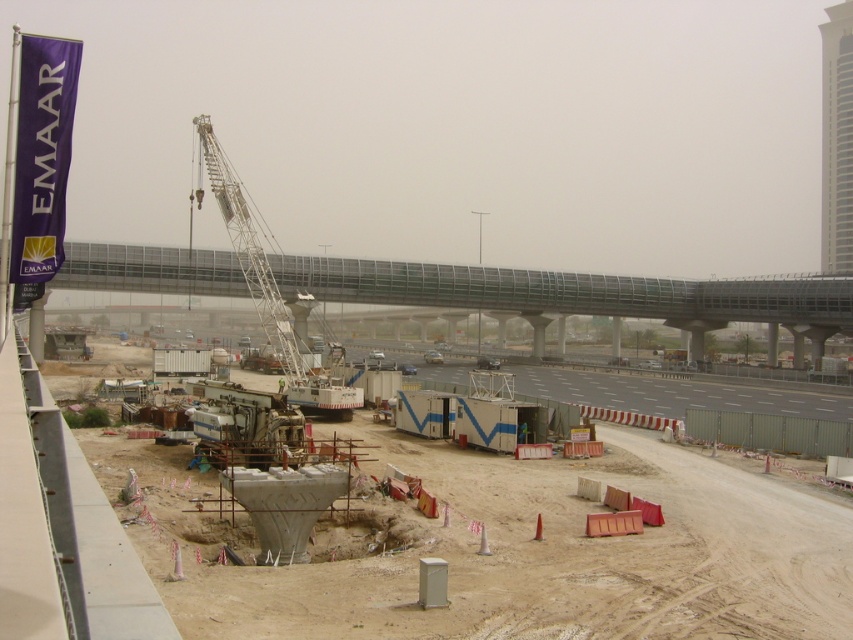
Question: From the image, what is the correct spatial relationship of metallic gray bridge at center in relation to gray concrete highway at center?

Choices:
 (A) left
 (B) right

Answer: (A)

Question: Which is farther from the white metallic crane at center-left?

Choices:
 (A) gray concrete highway at center
 (B) concrete at center
 (C) metallic gray bridge at center

Answer: (C)

Question: Which point is farther to the camera?

Choices:
 (A) metallic gray bridge at center
 (B) gray concrete highway at center
 (C) white metallic crane at center-left

Answer: (A)

Question: Is concrete at center in front of white metallic crane at center-left?

Choices:
 (A) yes
 (B) no

Answer: (A)

Question: From the image, what is the correct spatial relationship of metallic gray bridge at center in relation to white metallic crane at center-left?

Choices:
 (A) right
 (B) left

Answer: (A)

Question: Considering the real-world distances, which object is farthest from the gray concrete highway at center?

Choices:
 (A) concrete at center
 (B) white metallic crane at center-left
 (C) metallic gray bridge at center

Answer: (A)